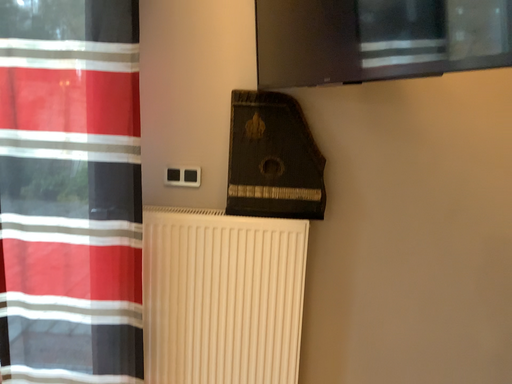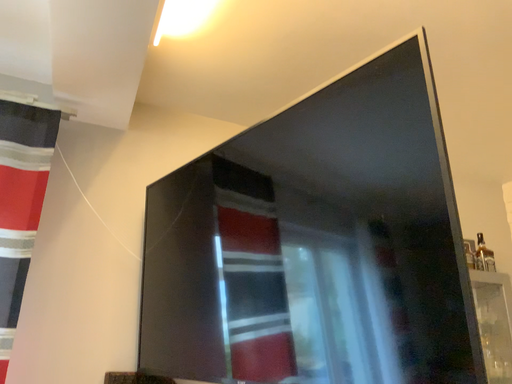
Question: Which way did the camera rotate in the video?

Choices:
 (A) rotated upward
 (B) rotated downward

Answer: (A)